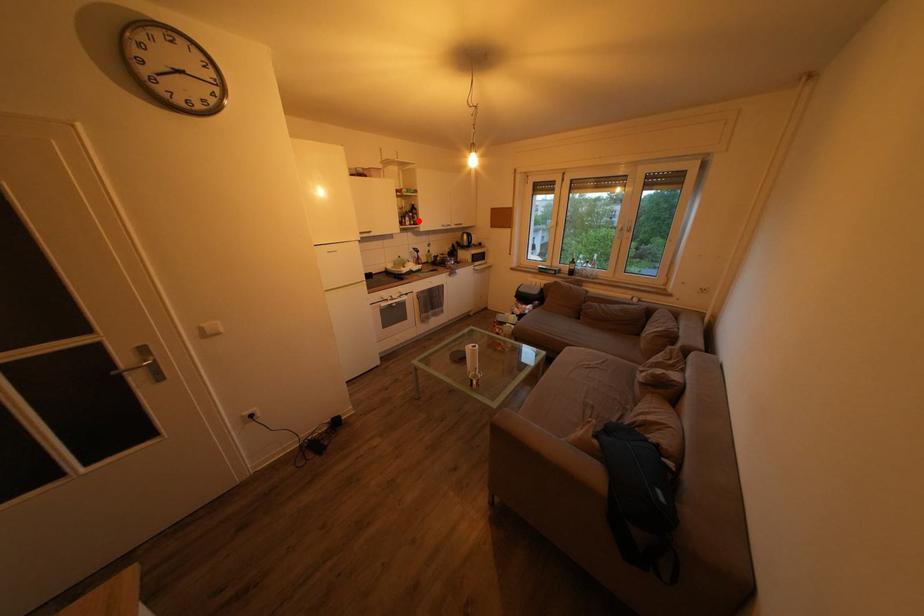
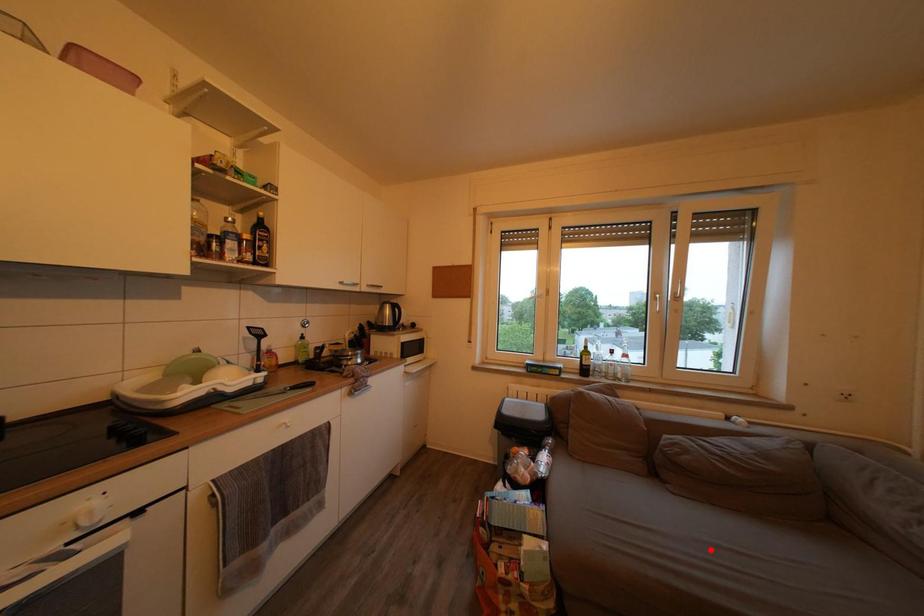
I am providing you with two images of the same scene from different viewpoints. A red point is marked on the first image and another point is marked on the second image. Is the red point in image1 aligned with the point shown in image2?

No